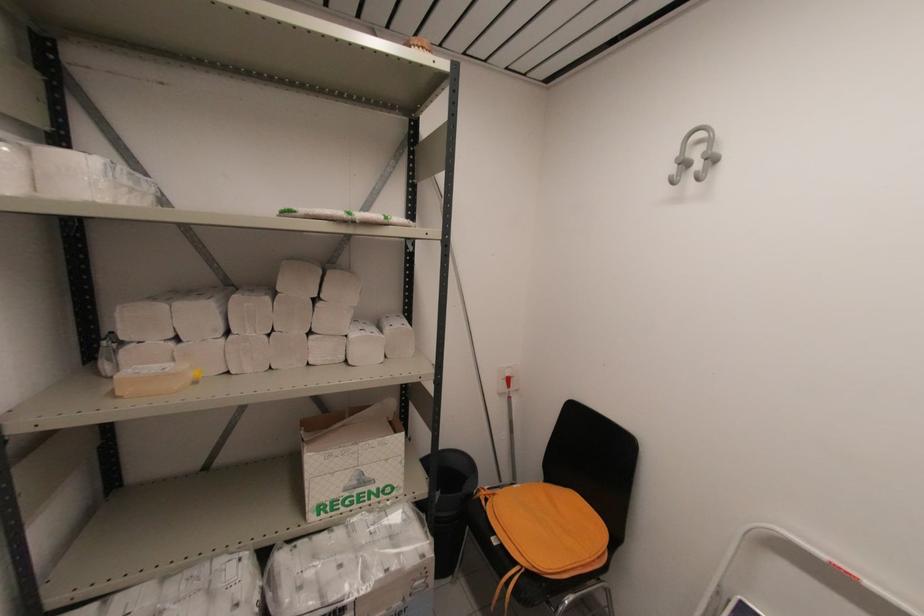
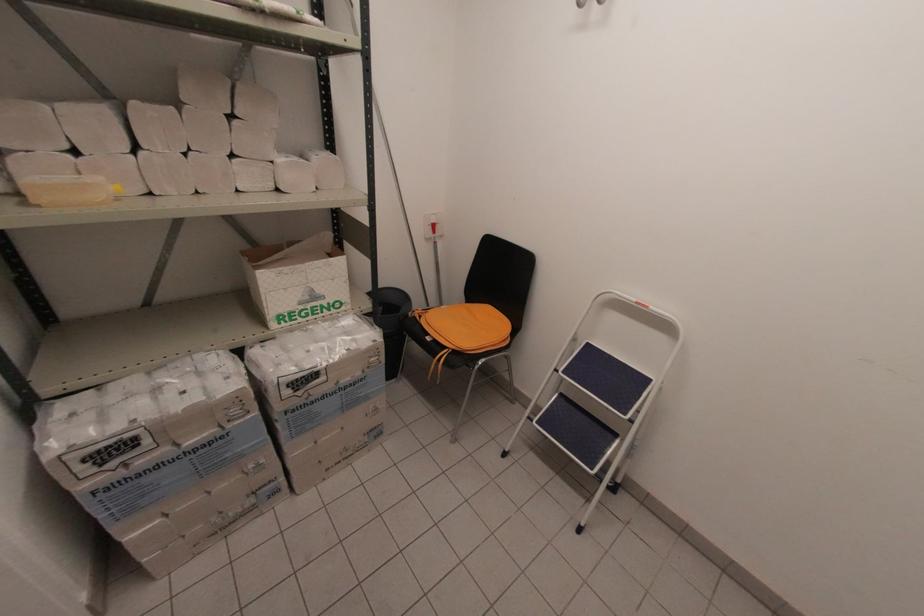
Locate, in the second image, the point that corresponds to the point at 356,483 in the first image.

(309, 298)